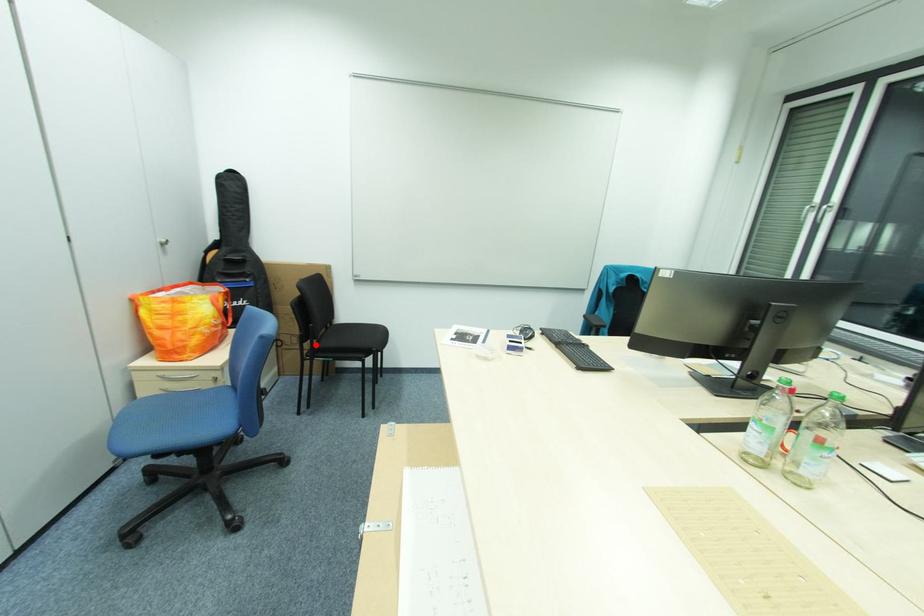
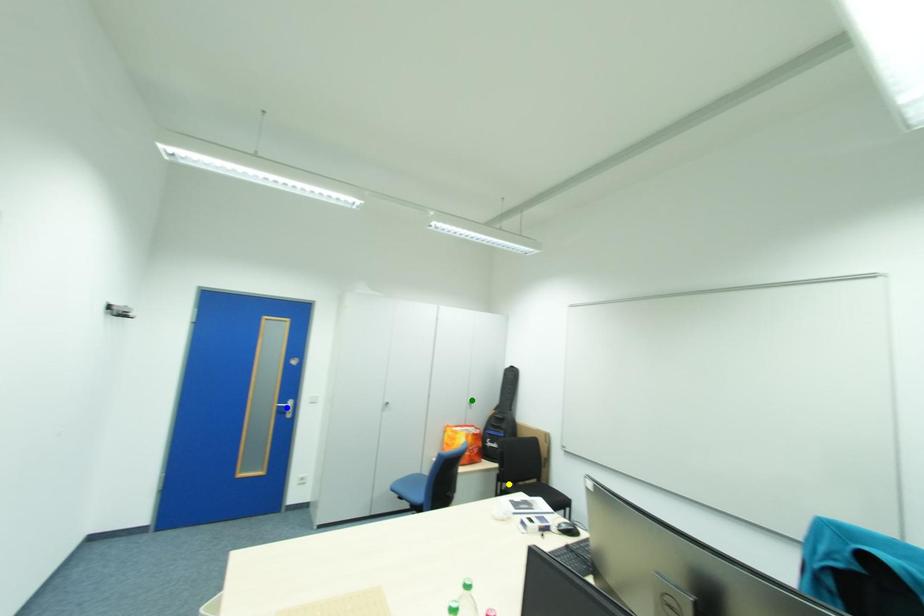
Question: I am providing you with two images of the same scene from different viewpoints. A red point is marked on the first image. You are given multiple points on the second image. Which spot in image 2 lines up with the point in image 1?

Choices:
 (A) yellow point
 (B) green point
 (C) blue point

Answer: (A)